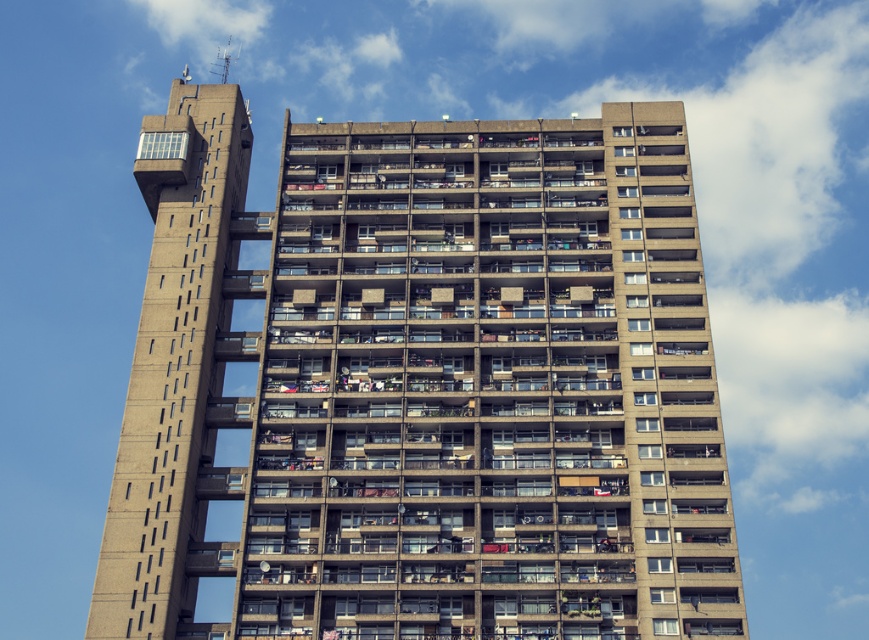
You are a delivery drone flying towards the concrete building at center and the concrete tower at upper left. Which structure should you target if you need to land on the higher elevation?

You should target the concrete tower at upper left because it is higher than the concrete building at center, as the concrete building at center is located below the concrete tower at upper left.

You are standing at the point labeled as point (488, 387) in the image. What object are you facing?

The point labeled as point (488, 387) indicates the concrete building at center, so you are facing the concrete building at center.